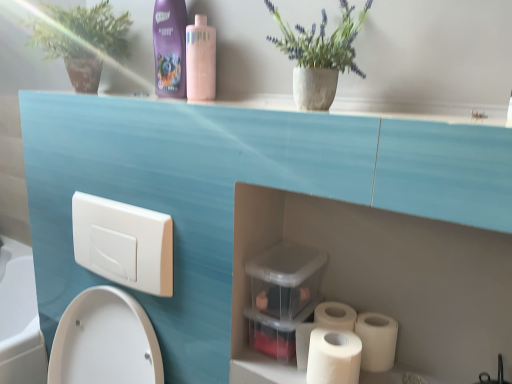
Question: Is there a large distance between white matte toilet paper at lower right, which appears as the 1th toilet paper when viewed from the right, and white matte toilet paper at lower right, the first toilet paper when ordered from left to right?

Choices:
 (A) no
 (B) yes

Answer: (A)

Question: Does white matte toilet paper at lower right, which appears as the 1th toilet paper when viewed from the right, have a smaller size compared to white matte toilet paper at lower right, the first toilet paper when ordered from left to right?

Choices:
 (A) yes
 (B) no

Answer: (A)

Question: Can we say white matte toilet paper at lower right, marked as the second toilet paper in a left-to-right arrangement, lies outside white matte toilet paper at lower right, the second toilet paper positioned from the right?

Choices:
 (A) yes
 (B) no

Answer: (A)

Question: Is white matte toilet paper at lower right, marked as the second toilet paper in a left-to-right arrangement, thinner than white matte toilet paper at lower right, the first toilet paper when ordered from left to right?

Choices:
 (A) no
 (B) yes

Answer: (B)

Question: Is white matte toilet paper at lower right, which appears as the 1th toilet paper when viewed from the right, facing towards white matte toilet paper at lower right, the second toilet paper positioned from the right?

Choices:
 (A) no
 (B) yes

Answer: (B)

Question: In terms of size, does white matte toilet paper at lower right, which appears as the 1th toilet paper when viewed from the right, appear bigger or smaller than pink matte bottle at upper center, arranged as the 1th cleaning product when viewed from the right?

Choices:
 (A) big
 (B) small

Answer: (B)

Question: Considering the positions of white matte toilet paper at lower right, marked as the second toilet paper in a left-to-right arrangement, and pink matte bottle at upper center, which is the second cleaning product from left to right, in the image, is white matte toilet paper at lower right, marked as the second toilet paper in a left-to-right arrangement, taller or shorter than pink matte bottle at upper center, which is the second cleaning product from left to right,?

Choices:
 (A) short
 (B) tall

Answer: (A)

Question: From the image's perspective, is white matte toilet paper at lower right, which appears as the 1th toilet paper when viewed from the right, positioned above or below pink matte bottle at upper center, arranged as the 1th cleaning product when viewed from the right?

Choices:
 (A) below
 (B) above

Answer: (A)

Question: Considering their positions, is white matte toilet paper at lower right, marked as the second toilet paper in a left-to-right arrangement, located in front of or behind pink matte bottle at upper center, arranged as the 1th cleaning product when viewed from the right?

Choices:
 (A) behind
 (B) front

Answer: (B)

Question: Which is correct: green matte plant at upper left is inside white matte toilet paper at lower right, which appears as the 1th toilet paper when viewed from the right, or outside of it?

Choices:
 (A) inside
 (B) outside

Answer: (B)

Question: In the image, is green matte plant at upper left positioned in front of or behind white matte toilet paper at lower right, which appears as the 1th toilet paper when viewed from the right?

Choices:
 (A) behind
 (B) front

Answer: (A)

Question: From a real-world perspective, relative to white matte toilet paper at lower right, which appears as the 1th toilet paper when viewed from the right, is green matte plant at upper left vertically above or below?

Choices:
 (A) above
 (B) below

Answer: (A)

Question: Does point (117, 38) appear closer or farther from the camera than point (374, 319)?

Choices:
 (A) farther
 (B) closer

Answer: (A)

Question: Relative to white matte toilet paper at lower right, the second toilet paper positioned from the right, is matte concrete pot at upper center in front or behind?

Choices:
 (A) front
 (B) behind

Answer: (A)

Question: Looking at the image, does matte concrete pot at upper center seem bigger or smaller compared to white matte toilet paper at lower right, the first toilet paper when ordered from left to right?

Choices:
 (A) big
 (B) small

Answer: (A)